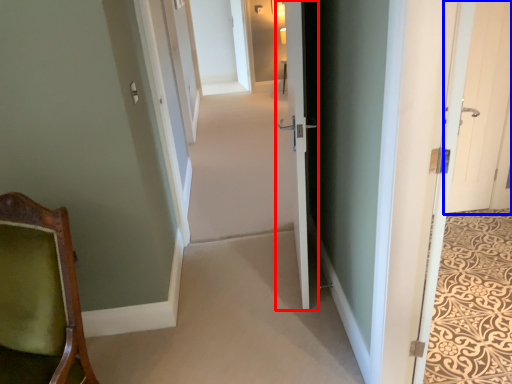
Question: Which point is further to the camera, door (highlighted by a red box) or door (highlighted by a blue box)?

Choices:
 (A) door
 (B) door

Answer: (B)